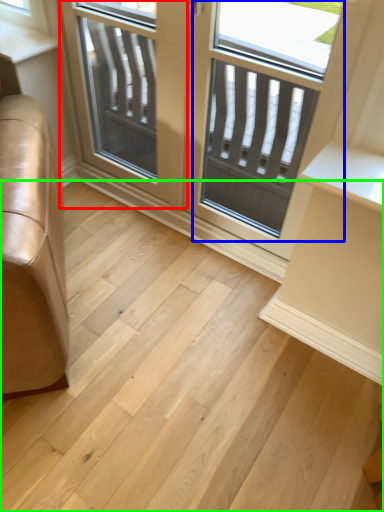
Question: Estimate the real-world distances between objects in this image. Which object is closer to screen door (highlighted by a red box), screen door (highlighted by a blue box) or stairwell (highlighted by a green box)?

Choices:
 (A) screen door
 (B) stairwell

Answer: (A)